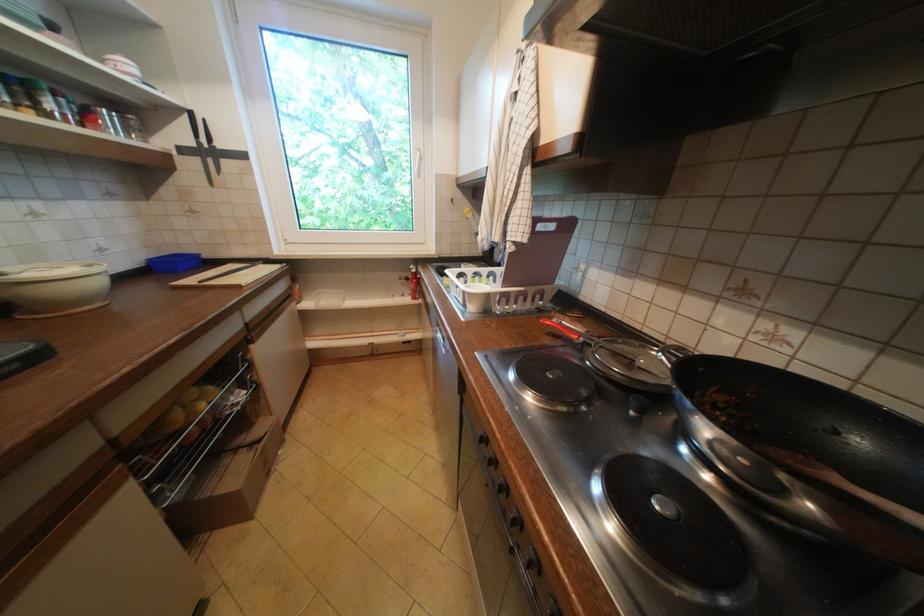
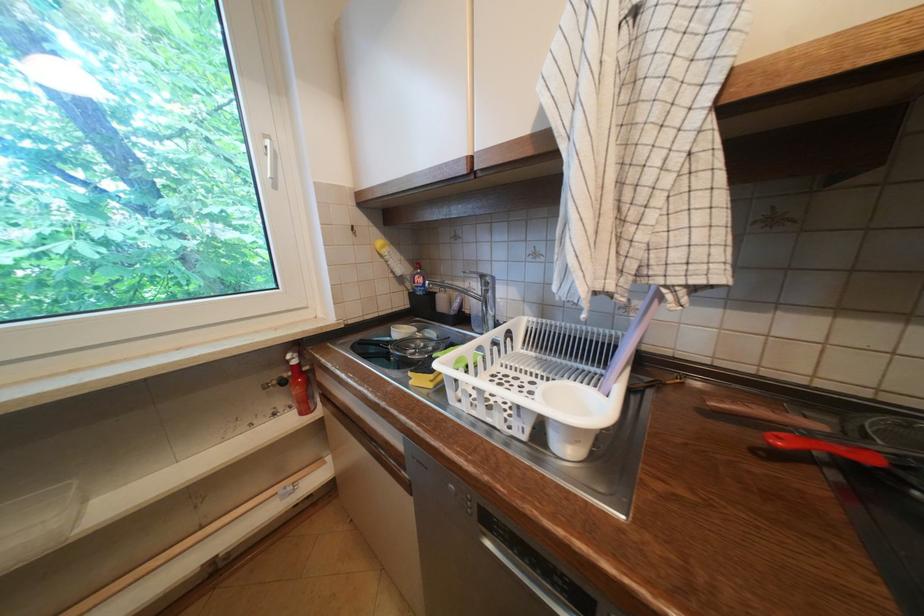
Question: The camera is either moving clockwise (left) or counter-clockwise (right) around the object. The first image is from the beginning of the video and the second image is from the end. Is the camera moving left or right when shooting the video?

Choices:
 (A) Left
 (B) Right

Answer: (A)